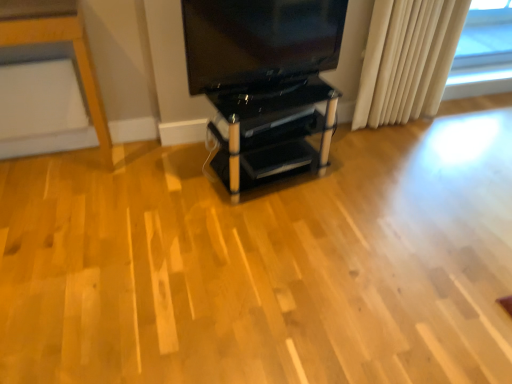
Image resolution: width=512 pixels, height=384 pixels. Identify the location of free space below white fabric curtain at right (from a real-world perspective). (379, 121).